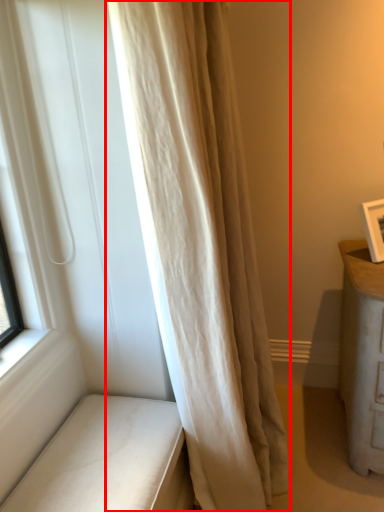
Question: From the image's perspective, what is the correct spatial relationship of curtain (annotated by the red box) in relation to furniture?

Choices:
 (A) above
 (B) below

Answer: (A)